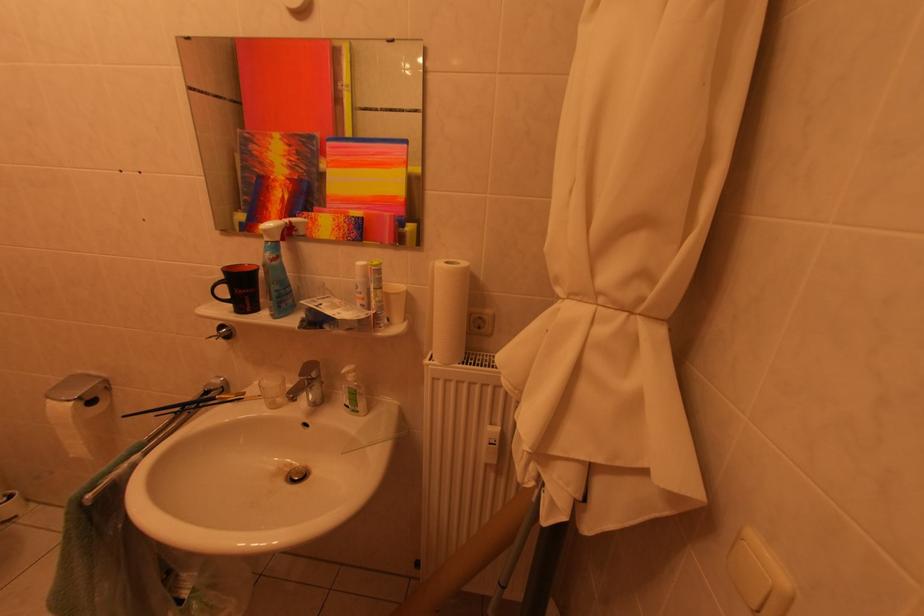
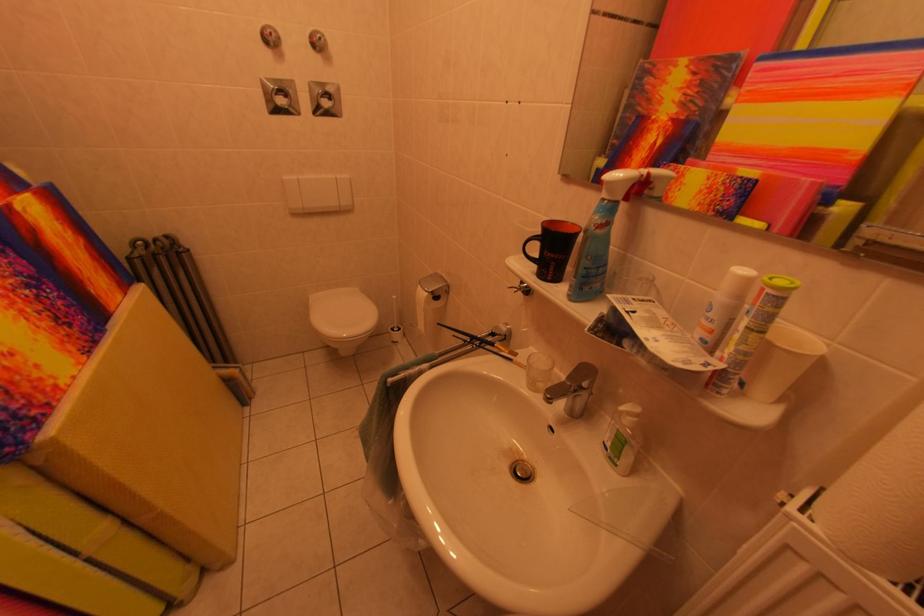
Question: I am providing you with two images of the same scene from different viewpoints. Which of the following objects are not visible in image2?

Choices:
 (A) small drinking glass
 (B) tablet tube
 (C) soap dispenser pump
 (D) none of these

Answer: (D)